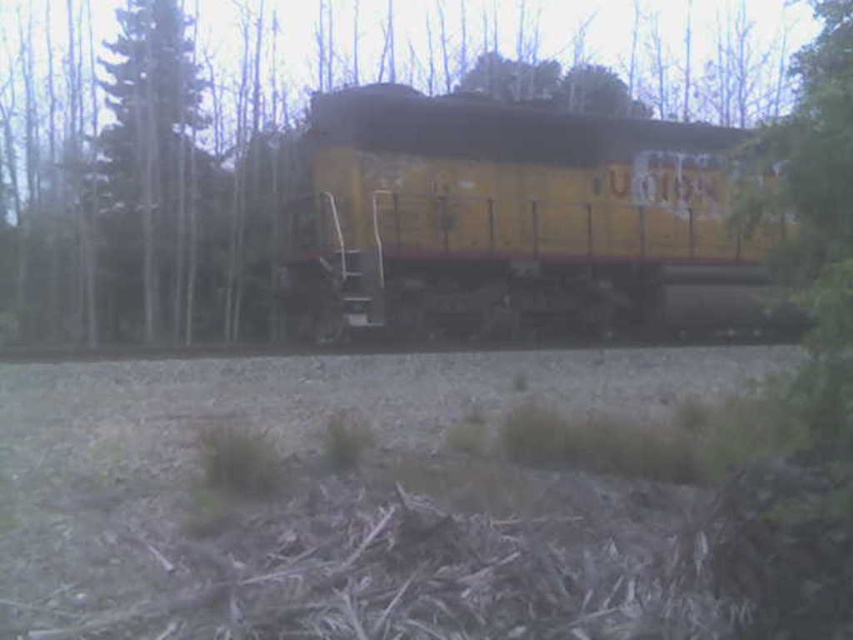
You are a photographer planning to take a photo of the yellow matte train at center. You want to ensure the green leafy tree at center is fully visible in the background. Will the tree be entirely visible behind the train?

The green leafy tree at center is taller than the yellow matte train at center, so the tree will be entirely visible behind the train as it surpasses the train in height.

You are standing near the yellow train car and want to walk towards the green leafy tree at center. Which direction should you move relative to the green textured tree at left?

You should move to the right of the green textured tree at left to reach the green leafy tree at center because the green leafy tree at center is positioned to the right of the green textured tree at left.

You are standing near the yellow matte train at center and want to throw a small ball to a friend who is standing 10 meters away from you in the same direction. Will the ball reach your friend before hitting the train?

The yellow matte train at center is 7.04 meters away from you. Since your friend is 10 meters away in the same direction, the ball will hit the train before reaching your friend.